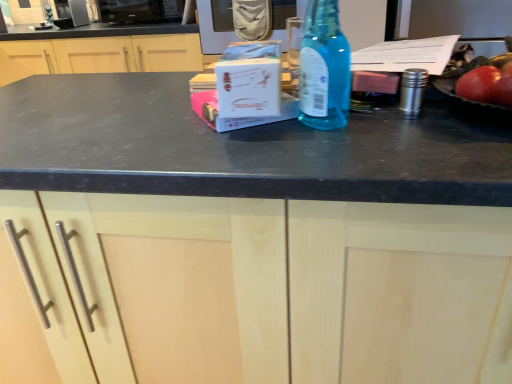
Question: Should I look upward or downward to see blue glass bottle at center?

Choices:
 (A) up
 (B) down

Answer: (A)

Question: From the image's perspective, does satin silver microwave at upper left, the 1th appliance viewed from the left, appear lower than blue glass bottle at center?

Choices:
 (A) yes
 (B) no

Answer: (B)

Question: Is satin silver microwave at upper left, the 1th appliance viewed from the left, not inside blue glass bottle at center?

Choices:
 (A) no
 (B) yes

Answer: (B)

Question: From a real-world perspective, is satin silver microwave at upper left, the 2th appliance when ordered from right to left, located beneath blue glass bottle at center?

Choices:
 (A) no
 (B) yes

Answer: (B)

Question: Is blue glass bottle at center surrounded by satin silver microwave at upper left, the 2th appliance when ordered from right to left?

Choices:
 (A) yes
 (B) no

Answer: (B)

Question: Does satin silver microwave at upper left, the 1th appliance viewed from the left, turn towards blue glass bottle at center?

Choices:
 (A) no
 (B) yes

Answer: (A)

Question: Is satin silver microwave at upper left, the 2th appliance when ordered from right to left, far away from blue glass bottle at center?

Choices:
 (A) yes
 (B) no

Answer: (A)

Question: Does satin silver microwave at upper left, the 1th appliance viewed from the left, have a lesser width compared to matte wood cabinet at center, acting as the first cabinetry starting from the back?

Choices:
 (A) yes
 (B) no

Answer: (A)

Question: Could you tell me if satin silver microwave at upper left, the 1th appliance viewed from the left, is facing matte wood cabinet at center, acting as the first cabinetry starting from the back?

Choices:
 (A) yes
 (B) no

Answer: (B)

Question: From the image's perspective, is satin silver microwave at upper left, the 2th appliance when ordered from right to left, below matte wood cabinet at center, acting as the first cabinetry starting from the back?

Choices:
 (A) no
 (B) yes

Answer: (A)

Question: Does satin silver microwave at upper left, the 1th appliance viewed from the left, have a lesser height compared to matte wood cabinet at center, acting as the 1th cabinetry starting from the top?

Choices:
 (A) yes
 (B) no

Answer: (A)

Question: Would you say satin silver microwave at upper left, the 2th appliance when ordered from right to left, is a long distance from matte wood cabinet at center, which appears as the second cabinetry when ordered from the bottom?

Choices:
 (A) no
 (B) yes

Answer: (A)

Question: Considering the relative sizes of satin silver microwave at upper left, the 1th appliance viewed from the left, and matte wood cabinet at center, which appears as the second cabinetry when ordered from the bottom, in the image provided, is satin silver microwave at upper left, the 1th appliance viewed from the left, taller than matte wood cabinet at center, which appears as the second cabinetry when ordered from the bottom,?

Choices:
 (A) yes
 (B) no

Answer: (B)

Question: Is matte wood cabinet at center, the second cabinetry viewed from the top, at the left side of matte wood cabinet at center, acting as the second cabinetry starting from the front?

Choices:
 (A) yes
 (B) no

Answer: (B)